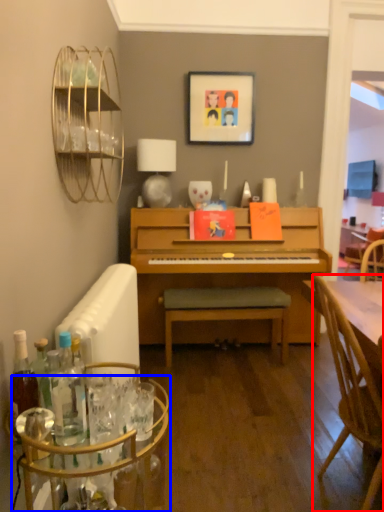
Question: Which of the following is the farthest to the observer, chair (highlighted by a red box) or glass table (highlighted by a blue box)?

Choices:
 (A) chair
 (B) glass table

Answer: (A)